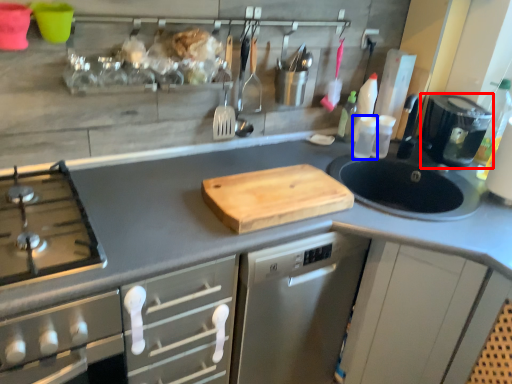
Question: Which object appears closest to the camera in this image, kitchen appliance (highlighted by a red box) or bottle (highlighted by a blue box)?

Choices:
 (A) kitchen appliance
 (B) bottle

Answer: (A)